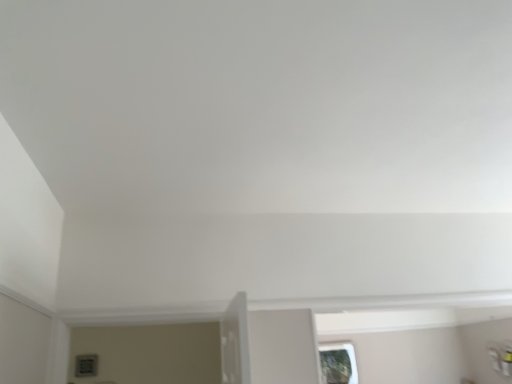
What is the approximate height of transparent glass window at lower right?

It is 47.98 centimeters.

Identify the location of transparent glass window at lower right. (338, 363).

Image resolution: width=512 pixels, height=384 pixels. Describe the element at coordinates (338, 363) in the screenshot. I see `transparent glass window at lower right` at that location.

I want to click on transparent glass window at lower right, so click(338, 363).